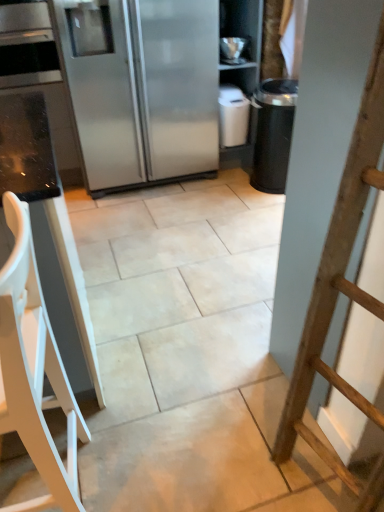
The width and height of the screenshot is (384, 512). I want to click on white plastic chair at left, so click(x=34, y=369).

The width and height of the screenshot is (384, 512). Describe the element at coordinates (34, 369) in the screenshot. I see `white plastic chair at left` at that location.

The image size is (384, 512). Describe the element at coordinates (142, 87) in the screenshot. I see `satin silver refrigerator at upper left` at that location.

The width and height of the screenshot is (384, 512). In order to click on satin silver refrigerator at upper left in this screenshot , I will do `click(142, 87)`.

The image size is (384, 512). In order to click on white plastic chair at left in this screenshot , I will do `click(34, 369)`.

Considering the positions of objects satin silver refrigerator at upper left and white plastic chair at left in the image provided, who is more to the right, satin silver refrigerator at upper left or white plastic chair at left?

Positioned to the right is satin silver refrigerator at upper left.

Is satin silver refrigerator at upper left in front of or behind white plastic chair at left in the image?

satin silver refrigerator at upper left is positioned farther from the viewer than white plastic chair at left.

Is point (211, 37) positioned in front of point (15, 277)?

That is False.

From the image's perspective, who appears lower, satin silver refrigerator at upper left or white plastic chair at left?

white plastic chair at left is shown below in the image.

From a real-world perspective, which is physically below, satin silver refrigerator at upper left or white plastic chair at left?

white plastic chair at left is physically lower.

Which of these two, satin silver refrigerator at upper left or white plastic chair at left, is wider?

Wider between the two is satin silver refrigerator at upper left.

Who is taller, satin silver refrigerator at upper left or white plastic chair at left?

Standing taller between the two is satin silver refrigerator at upper left.

Can you confirm if satin silver refrigerator at upper left is smaller than white plastic chair at left?

No.

Can we say satin silver refrigerator at upper left lies outside white plastic chair at left?

Indeed, satin silver refrigerator at upper left is completely outside white plastic chair at left.

Is satin silver refrigerator at upper left next to white plastic chair at left and touching it?

satin silver refrigerator at upper left and white plastic chair at left are not in contact.

Does satin silver refrigerator at upper left turn towards white plastic chair at left?

Yes.

Can you tell me how much satin silver refrigerator at upper left and white plastic chair at left differ in facing direction?

There is a 87.7-degree angle between the facing directions of satin silver refrigerator at upper left and white plastic chair at left.

How distant is satin silver refrigerator at upper left from white plastic chair at left?

The distance of satin silver refrigerator at upper left from white plastic chair at left is 6.04 feet.

Identify the location of furniture that appears on the left of satin silver refrigerator at upper left. The image size is (384, 512). (34, 369).

Is white plastic chair at left at the right side of satin silver refrigerator at upper left?

Incorrect, white plastic chair at left is not on the right side of satin silver refrigerator at upper left.

Is white plastic chair at left further to camera compared to satin silver refrigerator at upper left?

No, it is in front of satin silver refrigerator at upper left.

Is point (53, 334) closer or farther from the camera than point (170, 70)?

Point (53, 334) appears to be closer to the viewer than point (170, 70).

From the image's perspective, is white plastic chair at left above satin silver refrigerator at upper left?

No, from the image's perspective, white plastic chair at left is not above satin silver refrigerator at upper left.

From a real-world perspective, which is physically below, white plastic chair at left or satin silver refrigerator at upper left?

white plastic chair at left.

Can you confirm if white plastic chair at left is wider than satin silver refrigerator at upper left?

Incorrect, the width of white plastic chair at left does not surpass that of satin silver refrigerator at upper left.

From the picture: Between white plastic chair at left and satin silver refrigerator at upper left, which one has more height?

satin silver refrigerator at upper left.

Considering the sizes of objects white plastic chair at left and satin silver refrigerator at upper left in the image provided, who is smaller, white plastic chair at left or satin silver refrigerator at upper left?

white plastic chair at left.

Do you think white plastic chair at left is within satin silver refrigerator at upper left, or outside of it?

white plastic chair at left exists outside the volume of satin silver refrigerator at upper left.

Is white plastic chair at left positioned far away from satin silver refrigerator at upper left?

Yes, white plastic chair at left is far from satin silver refrigerator at upper left.

Is satin silver refrigerator at upper left at the back of white plastic chair at left?

No.

How much distance is there between white plastic chair at left and satin silver refrigerator at upper left?

They are 1.84 meters apart.

Where is `furniture that appears in front of the satin silver refrigerator at upper left`? furniture that appears in front of the satin silver refrigerator at upper left is located at coordinates (34, 369).

Where is `furniture lying in front of the satin silver refrigerator at upper left`? furniture lying in front of the satin silver refrigerator at upper left is located at coordinates (34, 369).

At what (x,y) coordinates should I click in order to perform the action: click on furniture located below the satin silver refrigerator at upper left (from the image's perspective). Please return your answer as a coordinate pair (x, y). Image resolution: width=384 pixels, height=512 pixels. Looking at the image, I should click on (34, 369).